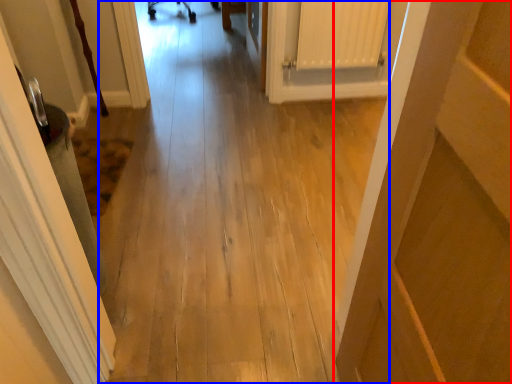
Question: Which object appears farthest to the camera in this image, door (highlighted by a red box) or path (highlighted by a blue box)?

Choices:
 (A) door
 (B) path

Answer: (B)